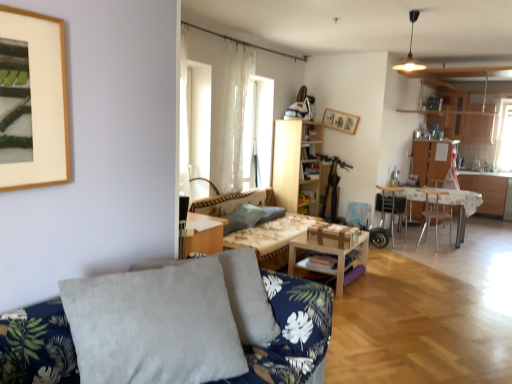
Locate an element on the screen. The width and height of the screenshot is (512, 384). vacant area on top of wooden picture frame at upper center (from a real-world perspective) is located at coordinates (340, 110).